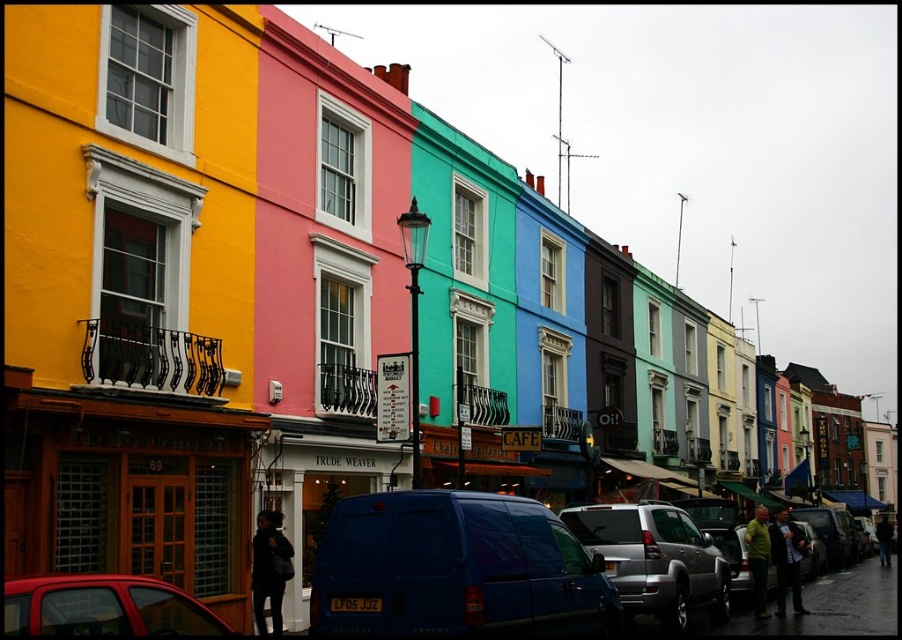
Where is `blue matte van at center`? Image resolution: width=902 pixels, height=640 pixels. blue matte van at center is located at coordinates (456, 568).

Looking at this image, which is below, blue matte van at center or metallic silver suv at center?

Positioned lower is metallic silver suv at center.

Does point (370, 604) come closer to viewer compared to point (703, 552)?

Yes, point (370, 604) is closer to viewer.

You are a GUI agent. You are given a task and a screenshot of the screen. Output one action in this format:
    pyautogui.click(x=<x>, y=<y>)
    Task: Click on the blue matte van at center
    
    Given the screenshot: What is the action you would take?
    pyautogui.click(x=456, y=568)

Is blue matte van at center further to camera compared to metallic red car at lower left?

Yes.

Can you confirm if blue matte van at center is bigger than metallic red car at lower left?

Correct, blue matte van at center is larger in size than metallic red car at lower left.

The width and height of the screenshot is (902, 640). I want to click on blue matte van at center, so click(x=456, y=568).

Does metallic silver suv at center have a greater height compared to metallic red car at lower left?

Yes, metallic silver suv at center is taller than metallic red car at lower left.

Can you confirm if metallic silver suv at center is smaller than metallic red car at lower left?

No, metallic silver suv at center is not smaller than metallic red car at lower left.

Image resolution: width=902 pixels, height=640 pixels. Describe the element at coordinates (654, 560) in the screenshot. I see `metallic silver suv at center` at that location.

At what (x,y) coordinates should I click in order to perform the action: click on metallic silver suv at center. Please return your answer as a coordinate pair (x, y). The width and height of the screenshot is (902, 640). Looking at the image, I should click on coord(654,560).